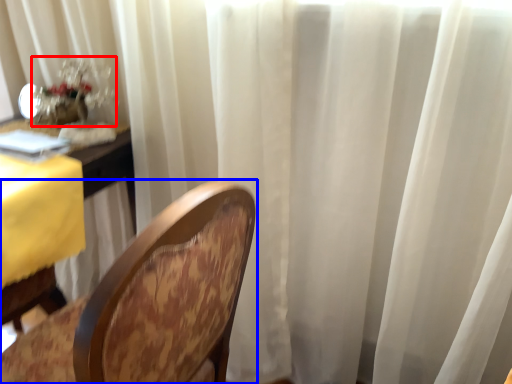
Question: Which point is further to the camera, floral arrangement (highlighted by a red box) or chair (highlighted by a blue box)?

Choices:
 (A) floral arrangement
 (B) chair

Answer: (A)